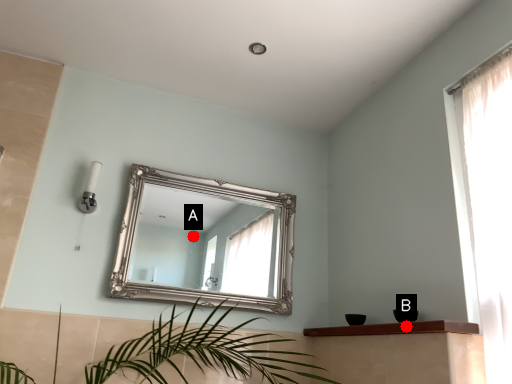
Question: Two points are circled on the image, labeled by A and B beside each circle. Which point is closer to the camera?

Choices:
 (A) A is closer
 (B) B is closer

Answer: (B)